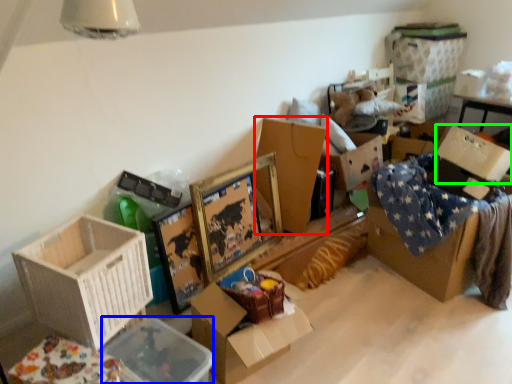
Question: Based on their relative distances, which object is nearer to box (highlighted by a red box)? Choose from storage box (highlighted by a blue box) and cardboard box (highlighted by a green box).

Choices:
 (A) storage box
 (B) cardboard box

Answer: (B)